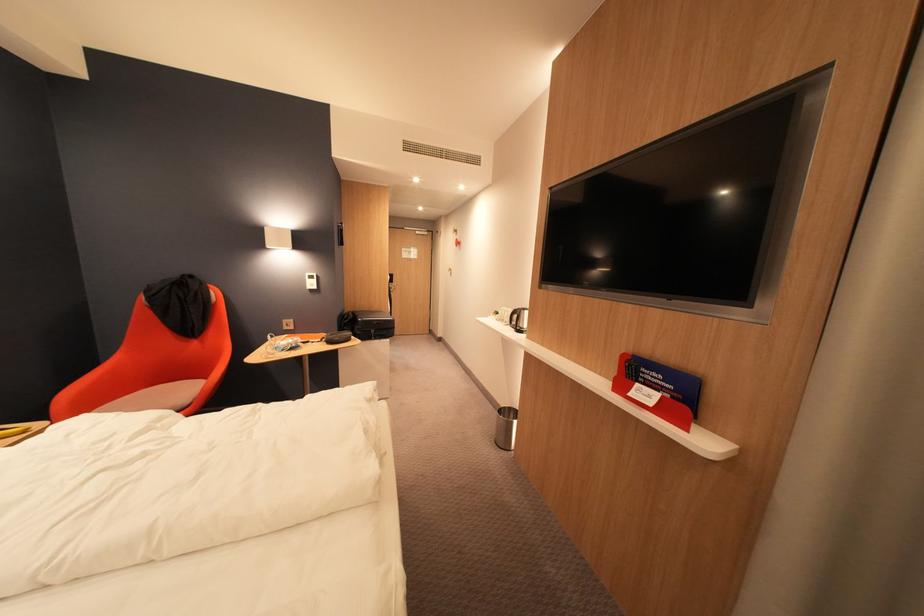
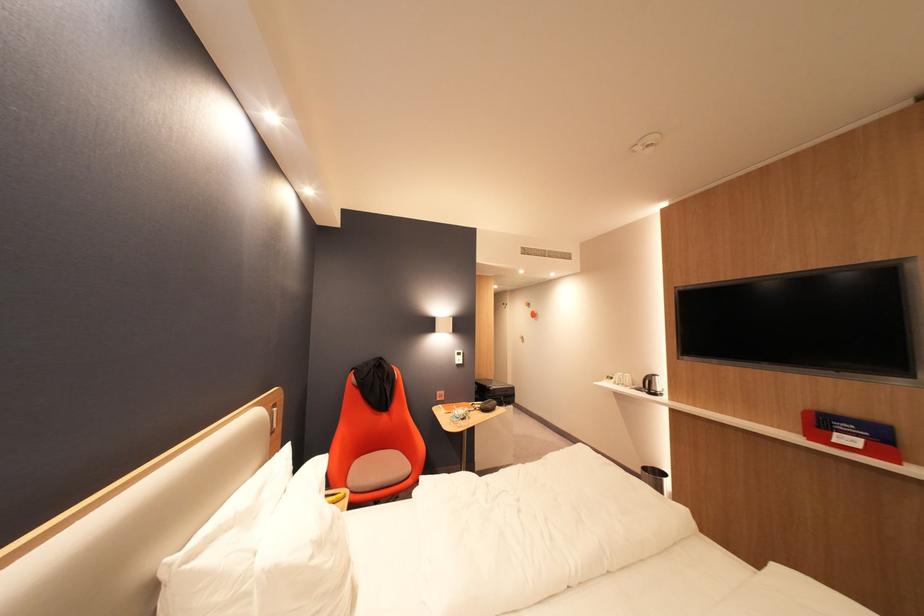
The point at (648, 386) is marked in the first image. Where is the corresponding point in the second image?

(846, 435)